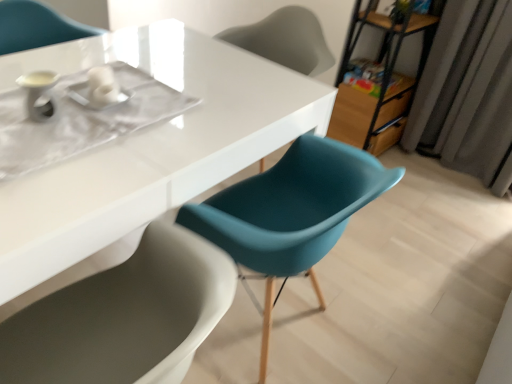
Question: Is metallic brown bookshelf at upper right wider or thinner than white glossy table at center?

Choices:
 (A) wide
 (B) thin

Answer: (B)

Question: Considering the positions of metallic brown bookshelf at upper right and white glossy table at center in the image, is metallic brown bookshelf at upper right bigger or smaller than white glossy table at center?

Choices:
 (A) small
 (B) big

Answer: (A)

Question: Considering the real-world distances, which object is closest to the matte teal chair at upper center, which appears as the second chair when ordered from the bottom?

Choices:
 (A) white glossy table at center
 (B) metallic brown bookshelf at upper right
 (C) gray fabric curtain at right
 (D) matte teal chair at center, which is counted as the 2th chair, starting from the back

Answer: (B)

Question: Considering the real-world distances, which object is farthest from the matte teal chair at upper center, which appears as the second chair when ordered from the bottom?

Choices:
 (A) matte teal chair at center, which appears as the first chair when ordered from the bottom
 (B) metallic brown bookshelf at upper right
 (C) gray fabric curtain at right
 (D) white glossy table at center

Answer: (A)